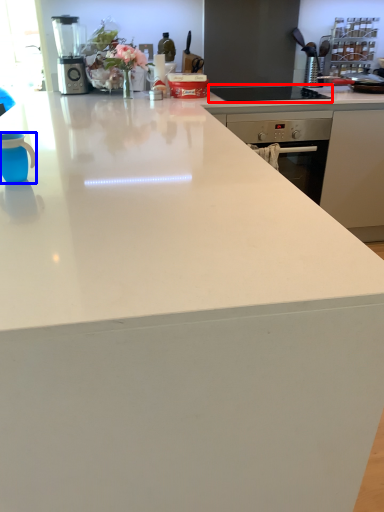
Question: Among these objects, which one is farthest to the camera, gas stove (highlighted by a red box) or mug (highlighted by a blue box)?

Choices:
 (A) gas stove
 (B) mug

Answer: (A)